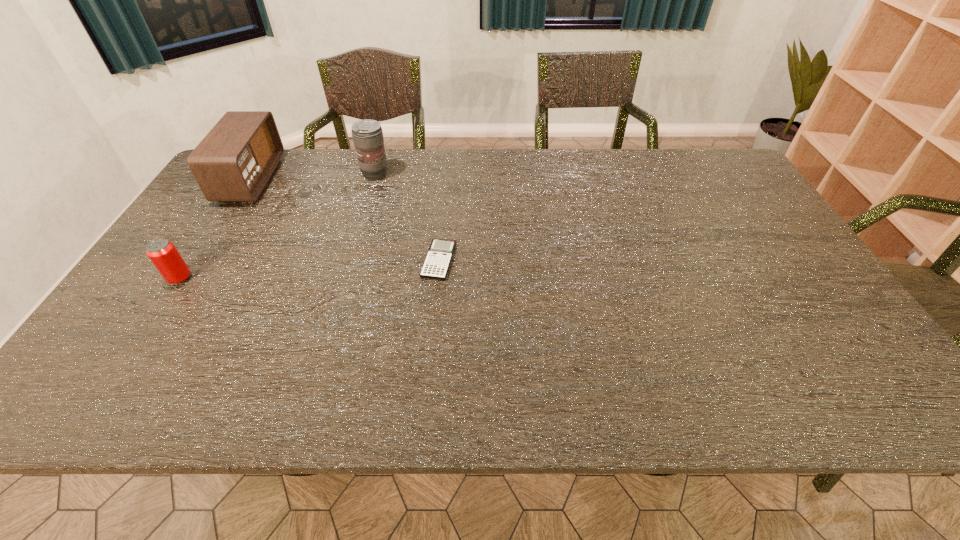
Image resolution: width=960 pixels, height=540 pixels. I want to click on blank space at the far right corner, so click(x=694, y=181).

In order to click on vacant space in between the second shortest object and the calculator in this screenshot , I will do pyautogui.click(x=309, y=269).

You are a GUI agent. You are given a task and a screenshot of the screen. Output one action in this format:
    pyautogui.click(x=<x>, y=<y>)
    Task: Click on the vacant area that lies between the radio receiver and the third object from left to right
    Image resolution: width=960 pixels, height=540 pixels.
    Given the screenshot: What is the action you would take?
    pyautogui.click(x=313, y=177)

Where is `vacant area that lies between the radio receiver and the can`? This screenshot has height=540, width=960. vacant area that lies between the radio receiver and the can is located at coordinates (216, 229).

Image resolution: width=960 pixels, height=540 pixels. I want to click on vacant area that lies between the can and the second object from right to left, so click(277, 226).

Locate an element on the screen. This screenshot has height=540, width=960. free space between the radio receiver and the third object from left to right is located at coordinates (313, 177).

At what (x,y) coordinates should I click in order to perform the action: click on unoccupied area between the third object from left to right and the can. Please return your answer as a coordinate pair (x, y). The width and height of the screenshot is (960, 540). Looking at the image, I should click on (277, 226).

You are a GUI agent. You are given a task and a screenshot of the screen. Output one action in this format:
    pyautogui.click(x=<x>, y=<y>)
    Task: Click on the free space between the can and the telephoto lens
    This screenshot has height=540, width=960.
    Given the screenshot: What is the action you would take?
    pyautogui.click(x=277, y=226)

In order to click on vacant area between the can and the radio receiver in this screenshot , I will do `click(216, 229)`.

Where is `free space that is in between the radio receiver and the second object from right to left`? The width and height of the screenshot is (960, 540). free space that is in between the radio receiver and the second object from right to left is located at coordinates (313, 177).